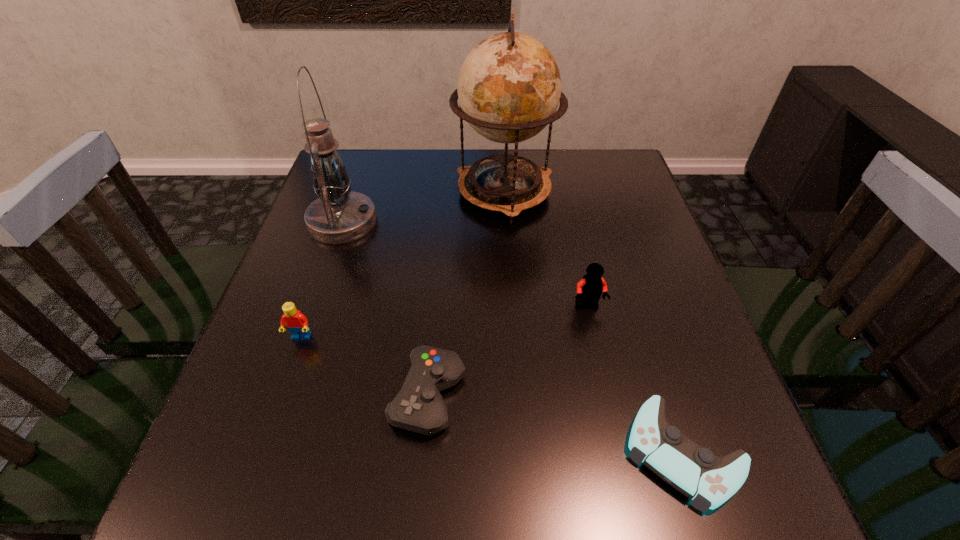
Find the location of a particular element. object that is at the right edge is located at coordinates (709, 480).

This screenshot has width=960, height=540. I want to click on object positioned at the near right corner, so click(709, 480).

The height and width of the screenshot is (540, 960). Identify the location of free space at the far edge of the desktop. (474, 157).

In the image, there is a desktop. At what (x,y) coordinates should I click in order to perform the action: click on blank space at the near edge. Please return your answer as a coordinate pair (x, y). Looking at the image, I should click on (378, 486).

Image resolution: width=960 pixels, height=540 pixels. In the image, there is a desktop. Identify the location of vacant space at the left edge. (285, 295).

In the image, there is a desktop. At what (x,y) coordinates should I click in order to perform the action: click on vacant region at the right edge. Please return your answer as a coordinate pair (x, y). Looking at the image, I should click on (631, 211).

In the image, there is a desktop. Where is `vacant area at the far left corner`? This screenshot has width=960, height=540. vacant area at the far left corner is located at coordinates (353, 181).

This screenshot has height=540, width=960. In order to click on unoccupied area between the right control and the second shortest object in this screenshot , I will do `click(556, 424)`.

You are a GUI agent. You are given a task and a screenshot of the screen. Output one action in this format:
    pyautogui.click(x=<x>, y=<y>)
    Task: Click on the free space between the globe and the left control
    
    Given the screenshot: What is the action you would take?
    pyautogui.click(x=467, y=294)

Where is `vacant space in between the nearer Lego and the oil lamp`? vacant space in between the nearer Lego and the oil lamp is located at coordinates (322, 279).